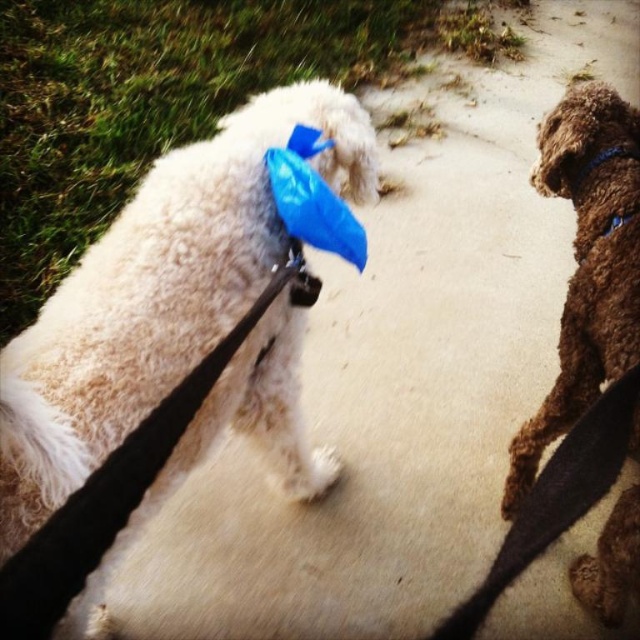
Question: Is white fluffy dog at upper left thinner than black leather leash at lower right?

Choices:
 (A) no
 (B) yes

Answer: (A)

Question: Is white fluffy dog at upper left wider than brown fuzzy dog at right?

Choices:
 (A) no
 (B) yes

Answer: (B)

Question: Which point is closer to the camera taking this photo?

Choices:
 (A) (464, 604)
 (B) (584, 396)

Answer: (B)

Question: Estimate the real-world distances between objects in this image. Which object is closer to the black leather leash at lower right?

Choices:
 (A) white fluffy dog at upper left
 (B) brown fuzzy dog at right

Answer: (B)

Question: Based on their relative distances, which object is farther from the white fluffy dog at upper left?

Choices:
 (A) black leather leash at lower right
 (B) brown fuzzy dog at right

Answer: (B)

Question: Where is white fluffy dog at upper left located in relation to brown fuzzy dog at right in the image?

Choices:
 (A) above
 (B) below

Answer: (A)